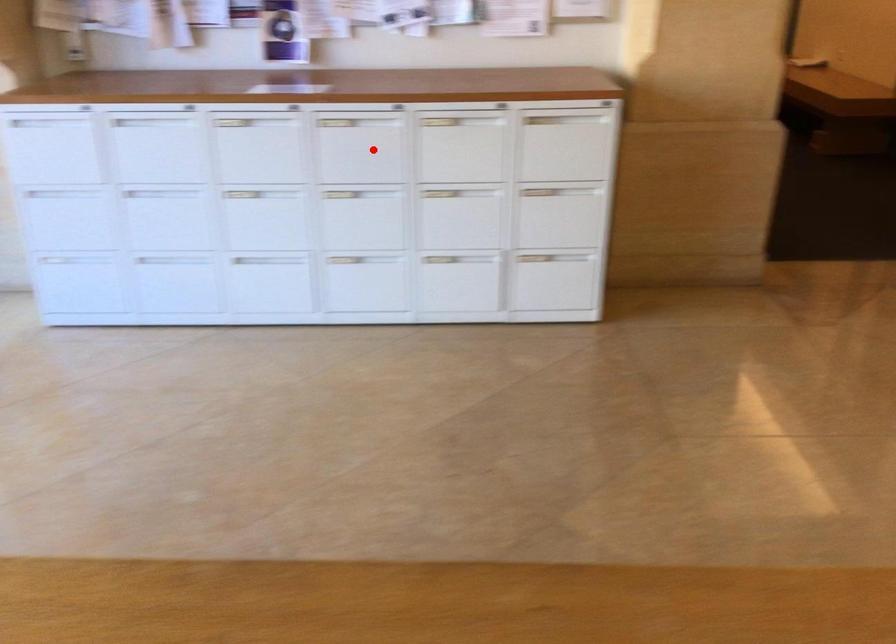
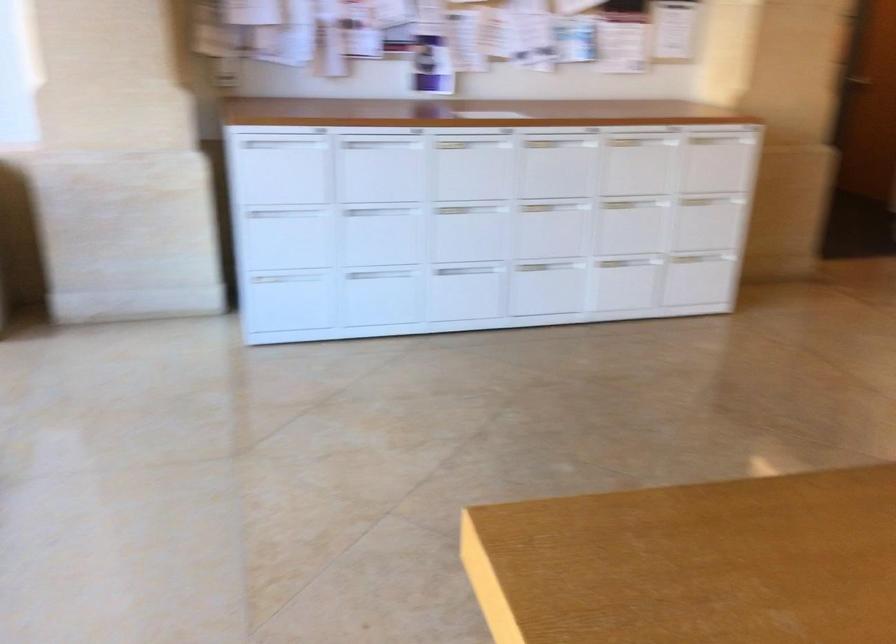
Find the pixel in the second image that matches the highlighted location in the first image.

(556, 163)